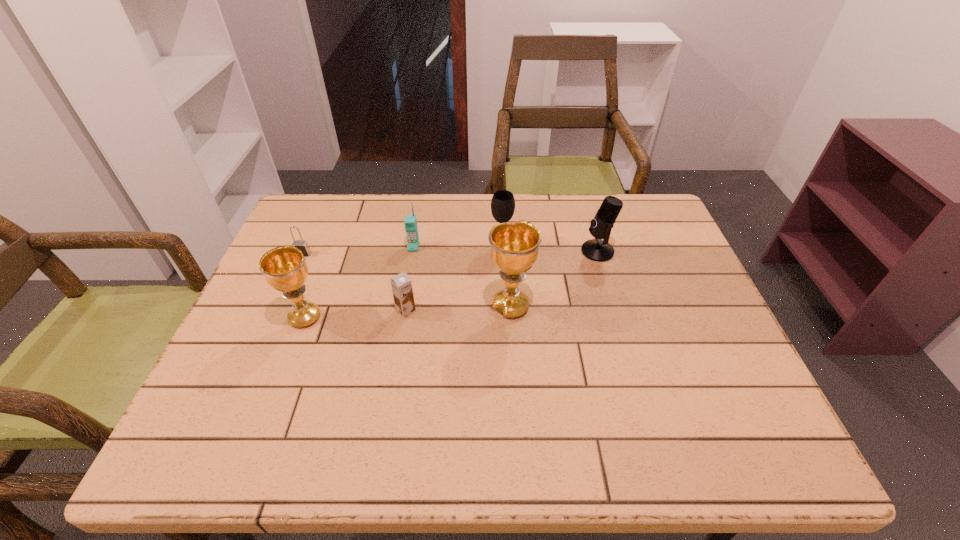
Where is `vacant position in the image that satisfies the following two spatial constraints: 1. on the stand of the rightmost object; 2. on the shackle of the shortest object`? The height and width of the screenshot is (540, 960). vacant position in the image that satisfies the following two spatial constraints: 1. on the stand of the rightmost object; 2. on the shackle of the shortest object is located at coordinates (598, 254).